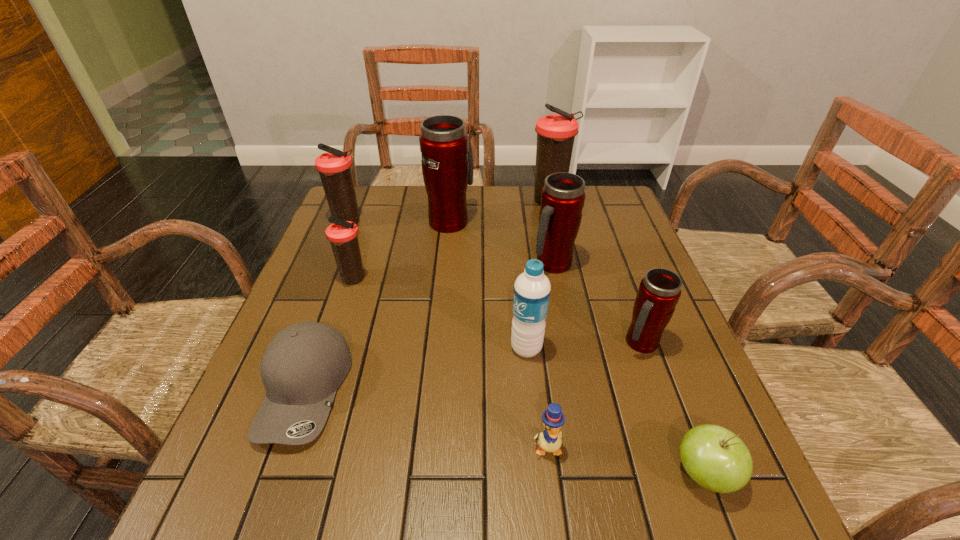
The width and height of the screenshot is (960, 540). Identify the location of vacant area that lies between the yellow duckling and the nearest red thermos bottle. pyautogui.click(x=594, y=395).

Where is `free space between the nearest brown thermos bottle and the third thermos bottle from left to right`? This screenshot has height=540, width=960. free space between the nearest brown thermos bottle and the third thermos bottle from left to right is located at coordinates (402, 250).

Where is `free point between the duckling and the rightmost thermos bottle`? free point between the duckling and the rightmost thermos bottle is located at coordinates (594, 395).

Locate an element on the screen. free area in between the smallest brown thermos bottle and the water bottle is located at coordinates (440, 314).

Find the location of a particular element. free space between the gray baseball cap and the green apple is located at coordinates (505, 432).

In order to click on object identified as the sixth closest to the biggest brown thermos bottle in this screenshot , I will do `click(343, 235)`.

Find the location of a particular element. This screenshot has width=960, height=540. object that stands as the ninth closest to the second biggest red thermos bottle is located at coordinates (334, 167).

Point out which thermos bottle is positioned as the nearest to the fourth thermos bottle from right to left. Please provide its 2D coordinates. Your answer should be formatted as a tuple, i.e. [(x, y)], where the tuple contains the x and y coordinates of a point satisfying the conditions above.

[(562, 199)]

Identify which thermos bottle is the second nearest to the duckling. Please provide its 2D coordinates. Your answer should be formatted as a tuple, i.e. [(x, y)], where the tuple contains the x and y coordinates of a point satisfying the conditions above.

[(562, 199)]

Select which brown thermos bottle is the second closest to the nearest brown thermos bottle. Please provide its 2D coordinates. Your answer should be formatted as a tuple, i.e. [(x, y)], where the tuple contains the x and y coordinates of a point satisfying the conditions above.

[(556, 133)]